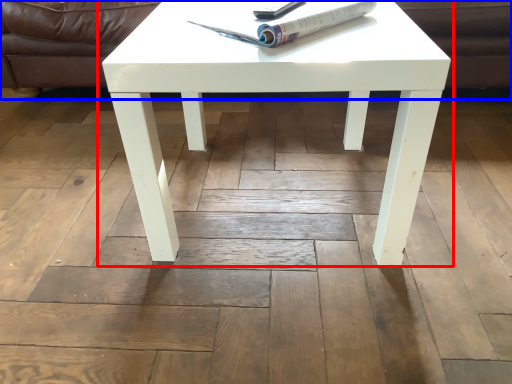
Question: Which object is further to the camera taking this photo, coffee table (highlighted by a red box) or couch (highlighted by a blue box)?

Choices:
 (A) coffee table
 (B) couch

Answer: (B)